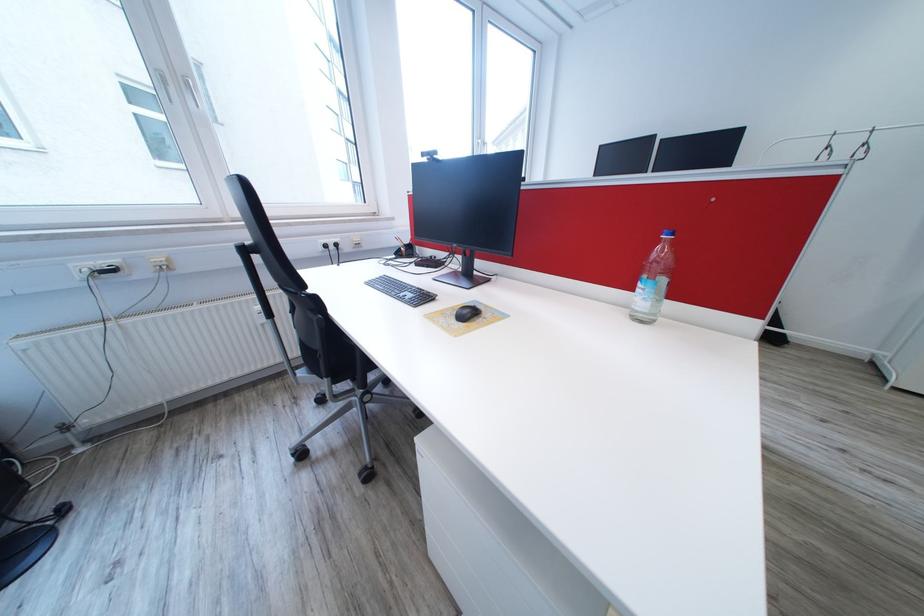
Where would you pull the black electrical plug? Please return your answer as a coordinate pair (x, y).

(62, 509)